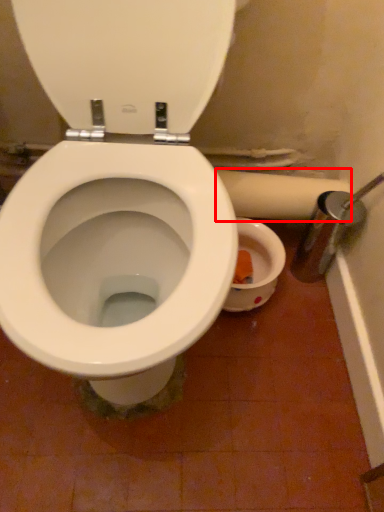
Question: From the image's perspective, considering the relative positions of toilet paper (annotated by the red box) and back in the image provided, where is toilet paper (annotated by the red box) located with respect to the staircase?

Choices:
 (A) below
 (B) above

Answer: (A)